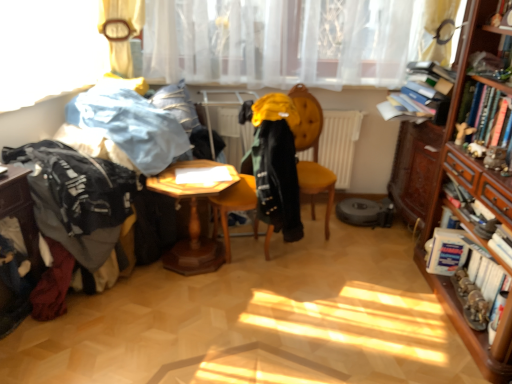
Find the location of a particular element. The height and width of the screenshot is (384, 512). free spot in front of yellow fabric swivel chair at center is located at coordinates (245, 286).